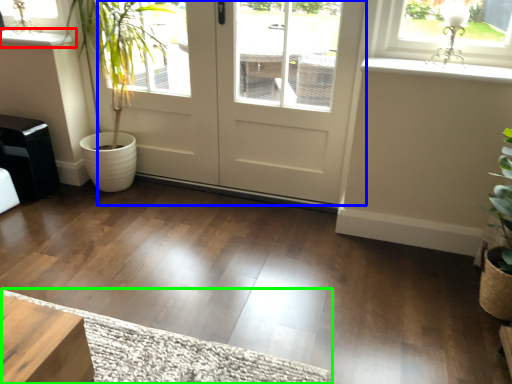
Question: Which object is the closest to the window sill (highlighted by a red box)? Choose among these: door (highlighted by a blue box) or doormat (highlighted by a green box).

Choices:
 (A) door
 (B) doormat

Answer: (A)